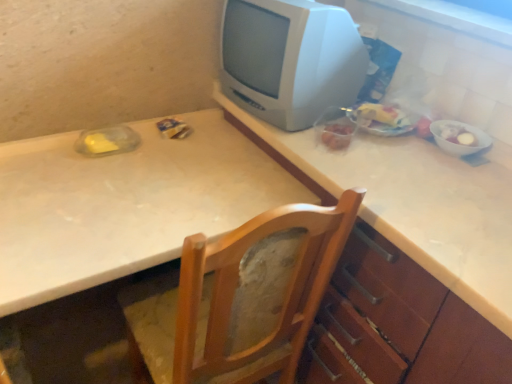
Question: From the image's perspective, is white glossy window sill at upper right located above wooden chair at center?

Choices:
 (A) yes
 (B) no

Answer: (A)

Question: Is white glossy window sill at upper right facing away from wooden chair at center?

Choices:
 (A) yes
 (B) no

Answer: (B)

Question: Can you confirm if white glossy window sill at upper right is bigger than wooden chair at center?

Choices:
 (A) no
 (B) yes

Answer: (A)

Question: Is white glossy window sill at upper right not within wooden chair at center?

Choices:
 (A) no
 (B) yes

Answer: (B)

Question: Considering the relative sizes of white glossy window sill at upper right and wooden chair at center in the image provided, is white glossy window sill at upper right wider than wooden chair at center?

Choices:
 (A) yes
 (B) no

Answer: (B)

Question: From their relative heights in the image, would you say white glossy window sill at upper right is taller or shorter than white glossy counter top at upper center?

Choices:
 (A) tall
 (B) short

Answer: (B)

Question: Based on their positions, is white glossy window sill at upper right located to the left or right of white glossy counter top at upper center?

Choices:
 (A) right
 (B) left

Answer: (A)

Question: Looking at the image, does white glossy window sill at upper right seem bigger or smaller compared to white glossy counter top at upper center?

Choices:
 (A) small
 (B) big

Answer: (A)

Question: Considering the positions of point [x=410, y=8] and point [x=429, y=233], is point [x=410, y=8] closer or farther from the camera than point [x=429, y=233]?

Choices:
 (A) farther
 (B) closer

Answer: (A)

Question: From a real-world perspective, is white laminate table at center positioned above or below white glossy bowl at right, arranged as the first food when viewed from the right?

Choices:
 (A) below
 (B) above

Answer: (A)

Question: Is point (25, 274) closer or farther from the camera than point (462, 142)?

Choices:
 (A) closer
 (B) farther

Answer: (A)

Question: From the image's perspective, is white laminate table at center positioned above or below white glossy bowl at right, arranged as the first food when viewed from the right?

Choices:
 (A) above
 (B) below

Answer: (B)

Question: Looking at the image, does white laminate table at center seem bigger or smaller compared to white glossy bowl at right, arranged as the first food when viewed from the right?

Choices:
 (A) small
 (B) big

Answer: (B)

Question: In terms of size, does white glossy counter top at upper center appear bigger or smaller than translucent plastic bag of food at right, arranged as the first food when viewed from the left?

Choices:
 (A) small
 (B) big

Answer: (B)

Question: From the image's perspective, is white glossy counter top at upper center above or below translucent plastic bag of food at right, arranged as the first food when viewed from the left?

Choices:
 (A) below
 (B) above

Answer: (A)